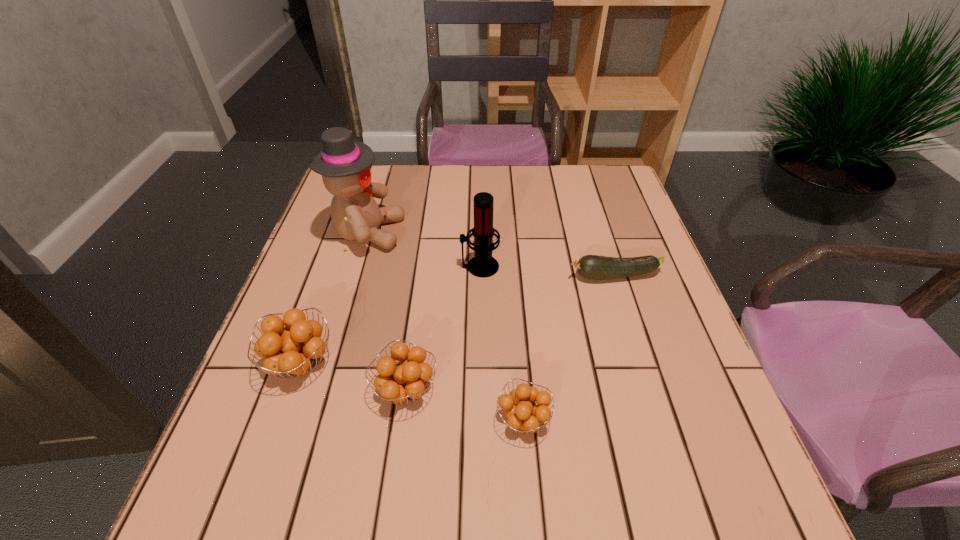
Identify the location of vacant space in between the tallest orange fruit and the rightmost object. (457, 319).

Find the location of a particular element. empty space that is in between the third object from left to right and the fifth shortest object is located at coordinates (443, 328).

Where is `empty space between the tallest orange fruit and the tallest object`? This screenshot has width=960, height=540. empty space between the tallest orange fruit and the tallest object is located at coordinates (334, 298).

Find the location of a particular element. unoccupied area between the second orange fruit from right to left and the rag_doll is located at coordinates (387, 311).

In order to click on vacant region between the second tallest orange fruit and the rag_doll in this screenshot , I will do `click(387, 311)`.

The image size is (960, 540). Identify the location of vacant space that is in between the third shortest object and the rag_doll. (387, 311).

You are a GUI agent. You are given a task and a screenshot of the screen. Output one action in this format:
    pyautogui.click(x=<x>, y=<y>)
    Task: Click on the vacant point located between the rightmost orange fruit and the rightmost object
    This screenshot has height=540, width=960.
    Given the screenshot: What is the action you would take?
    pyautogui.click(x=569, y=348)

The width and height of the screenshot is (960, 540). What are the coordinates of `free space between the fifth shortest object and the rag_doll` in the screenshot? It's located at (423, 249).

Locate an element on the screen. This screenshot has width=960, height=540. object that can be found as the closest to the fifth shortest object is located at coordinates (345, 165).

Locate which object ranks in proximity to the rightmost orange fruit. Please provide its 2D coordinates. Your answer should be formatted as a tuple, i.e. [(x, y)], where the tuple contains the x and y coordinates of a point satisfying the conditions above.

[(401, 383)]